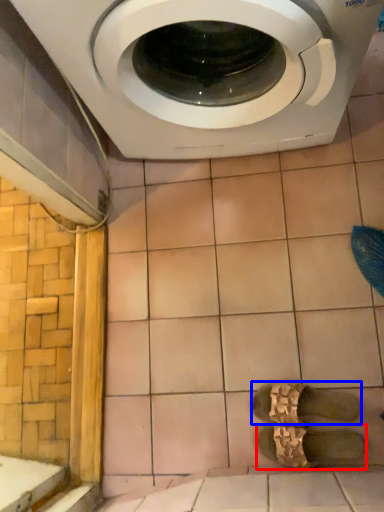
Question: Among these objects, which one is nearest to the camera, shoe (highlighted by a red box) or shoe (highlighted by a blue box)?

Choices:
 (A) shoe
 (B) shoe

Answer: (A)